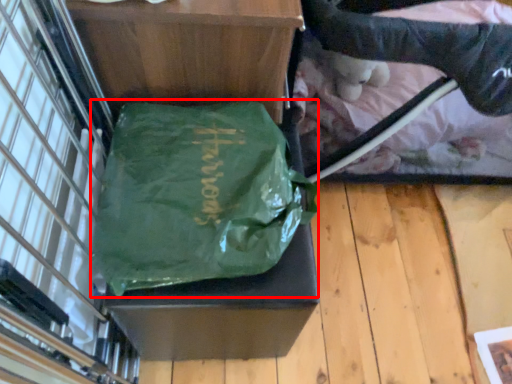
Question: From the image's perspective, where is tote bag (annotated by the red box) located in relation to baby carriage in the image?

Choices:
 (A) above
 (B) below

Answer: (B)